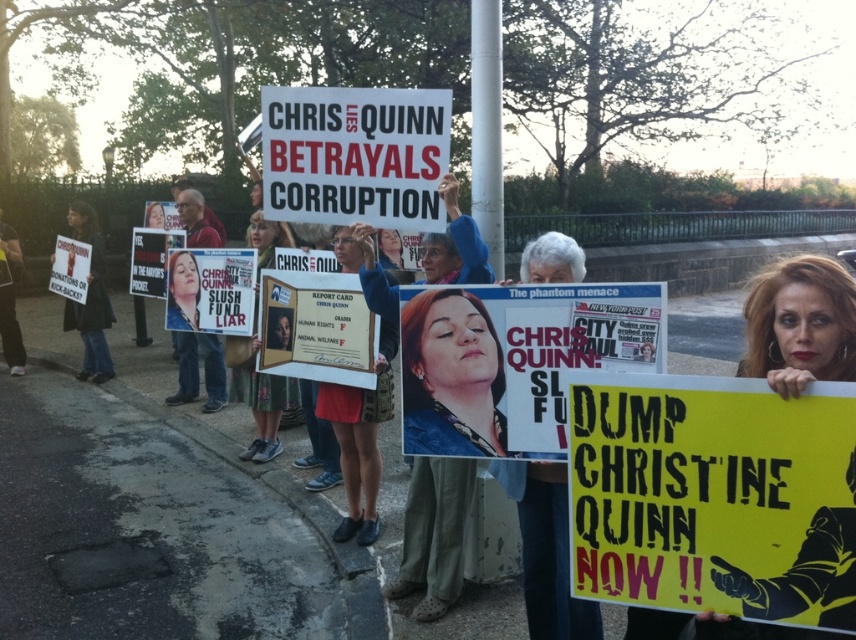
Question: Based on their relative distances, which object is nearer to the white paper sign at center?

Choices:
 (A) matte blue shirt at center
 (B) wooden plaque at center
 (C) matte blue fabric at center

Answer: (A)

Question: Estimate the real-world distances between objects in this image. Which object is farther from the floral dress at center?

Choices:
 (A) yellow paper sign at lower right
 (B) matte paper report card at center

Answer: (A)

Question: Among these objects, which one is nearest to the camera?

Choices:
 (A) black fabric jacket at left
 (B) wooden plaque at center
 (C) matte blue shirt at center

Answer: (C)

Question: Does white paper sign at center have a lesser width compared to matte yellow sign at center?

Choices:
 (A) yes
 (B) no

Answer: (A)

Question: Does yellow paper sign at lower right appear over white paper sign at center?

Choices:
 (A) no
 (B) yes

Answer: (A)

Question: Does white paper sign at center appear under wooden plaque at center?

Choices:
 (A) no
 (B) yes

Answer: (A)